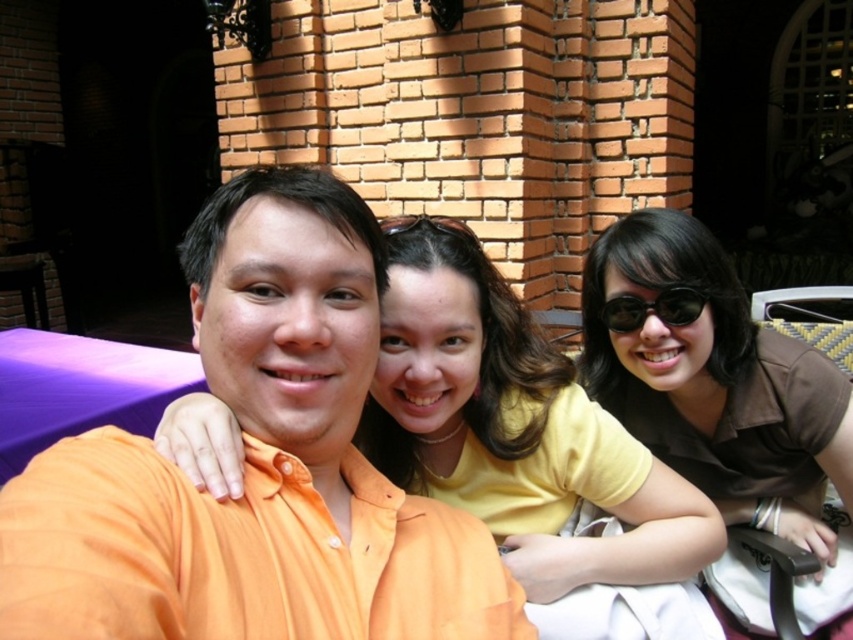
Is point (26, 358) farther from viewer compared to point (672, 314)?

That is True.

Is purple fabric table at lower left smaller than sunglasses at center?

Actually, purple fabric table at lower left might be larger than sunglasses at center.

Between point (113, 381) and point (688, 307), which one is positioned in front?

Point (688, 307)

I want to click on purple fabric table at lower left, so click(80, 388).

Does orange cotton shirt at center appear on the left side of brown matte shirt at center?

Correct, you'll find orange cotton shirt at center to the left of brown matte shirt at center.

Between orange cotton shirt at center and brown matte shirt at center, which one has less height?

orange cotton shirt at center

Does point (252, 216) come behind point (755, 413)?

That is False.

This screenshot has height=640, width=853. I want to click on orange cotton shirt at center, so click(256, 465).

Does orange cotton shirt at center appear under yellow matte shirt at center?

No, orange cotton shirt at center is not below yellow matte shirt at center.

Which is more to the left, orange cotton shirt at center or yellow matte shirt at center?

orange cotton shirt at center

Image resolution: width=853 pixels, height=640 pixels. Describe the element at coordinates (256, 465) in the screenshot. I see `orange cotton shirt at center` at that location.

This screenshot has width=853, height=640. Find the location of `orange cotton shirt at center`. orange cotton shirt at center is located at coordinates (256, 465).